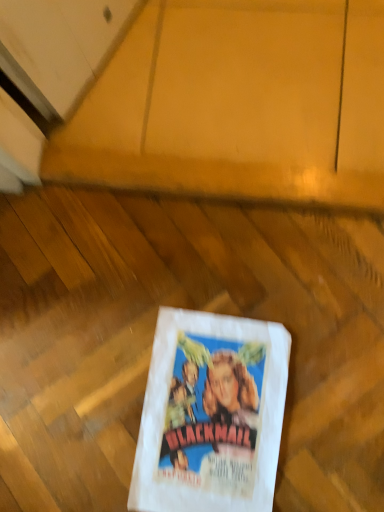
Find the location of a particular element. This screenshot has width=384, height=512. free point above white paper at center (from a real-world perspective) is located at coordinates (205, 423).